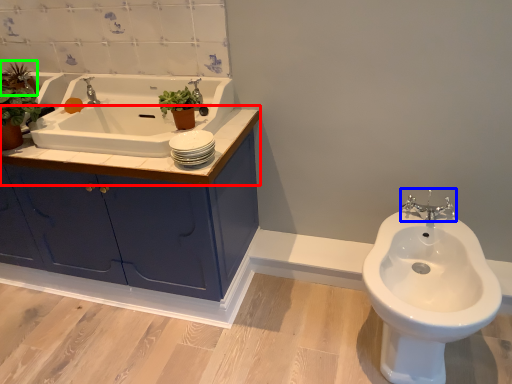
Question: Estimate the real-world distances between objects in this image. Which object is closer to counter top (highlighted by a red box), tap (highlighted by a blue box) or plant (highlighted by a green box)?

Choices:
 (A) tap
 (B) plant

Answer: (B)